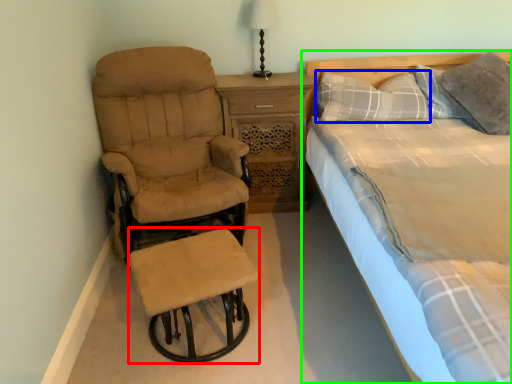
Question: Which object is the closest to the bar stool (highlighted by a red box)? Choose among these: pillow (highlighted by a blue box) or bed (highlighted by a green box).

Choices:
 (A) pillow
 (B) bed

Answer: (A)